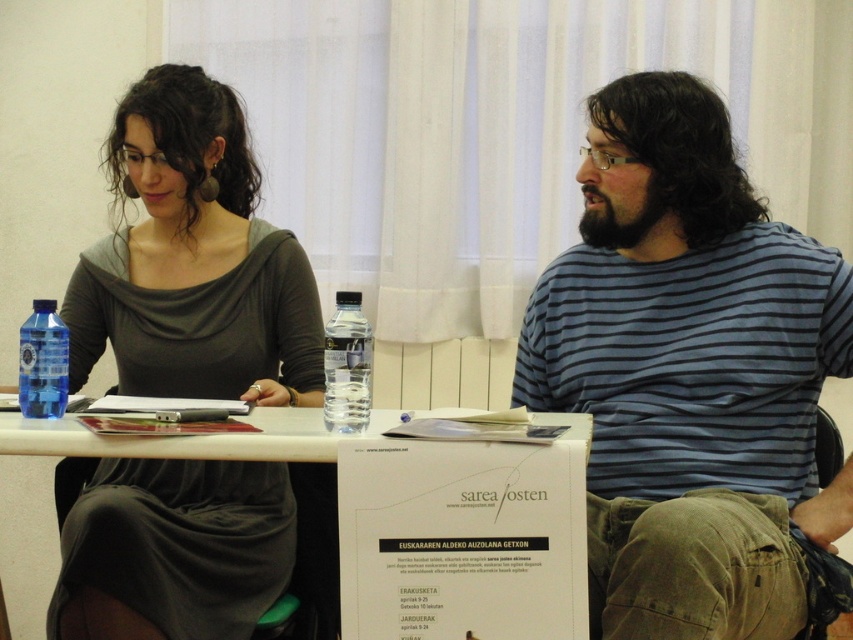
Can you confirm if matte gray dress at center is positioned below clear plastic bottle at center?

Yes.

Is point (169, 323) in front of point (345, 378)?

That is False.

What do you see at coordinates (193, 260) in the screenshot? I see `matte gray dress at center` at bounding box center [193, 260].

This screenshot has width=853, height=640. What are the coordinates of `matte gray dress at center` in the screenshot? It's located at (193, 260).

From the picture: Is matte gray dress at center wider than transparent plastic bottle at left?

Yes.

Can you confirm if matte gray dress at center is taller than transparent plastic bottle at left?

Indeed, matte gray dress at center has a greater height compared to transparent plastic bottle at left.

Which is in front, point (167, 483) or point (44, 388)?

Positioned in front is point (44, 388).

Locate an element on the screen. Image resolution: width=853 pixels, height=640 pixels. matte gray dress at center is located at coordinates (193, 260).

Does clear plastic bottle at center come behind transparent plastic bottle at left?

No, clear plastic bottle at center is in front of transparent plastic bottle at left.

Where is `clear plastic bottle at center`? This screenshot has height=640, width=853. clear plastic bottle at center is located at coordinates (347, 365).